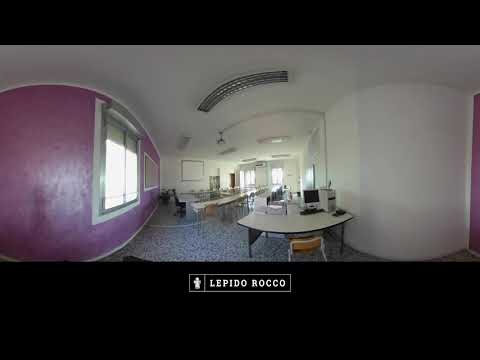
Locate an element on the screen. computer screen is located at coordinates (308, 199).